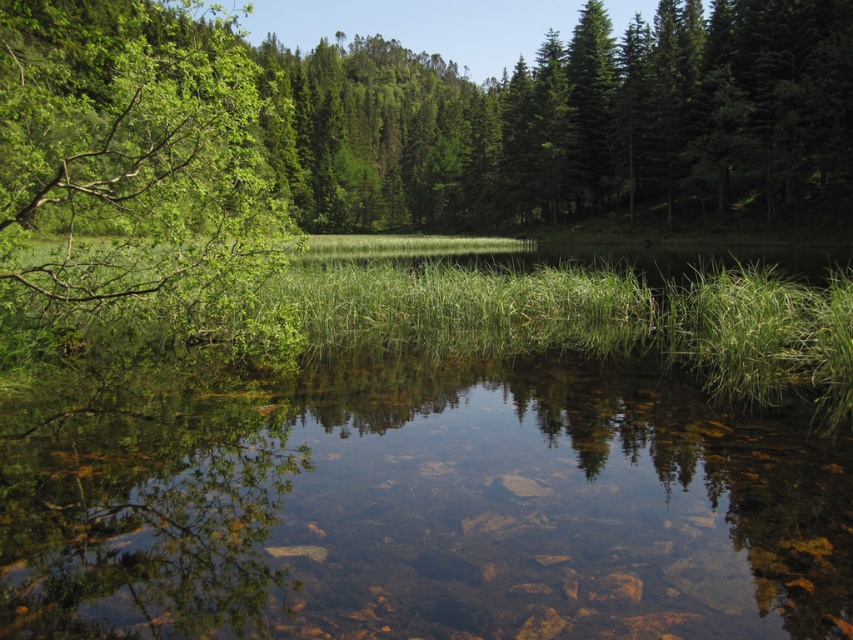
You are standing at the edge of the water and want to walk towards the green grass at center. Will you pass by the green leafy tree at left on your way?

Yes, you will pass by the green leafy tree at left on your way to the green grass at center because the green leafy tree at left is closer to you than the green grass at center.

You are standing at the edge of the water and want to walk towards the dense forest in the background. Which object will you step on first, the clear water at center or the green grass at center?

You will step on the clear water at center first because it is in front of the green grass at center, meaning the water is closer to your current position.

You are standing at the edge of the water in the serene landscape. You notice two points marked in the scene. Which point, point (202, 468) or point (252, 228), is closer to you?

Point (202, 468) is closer to the viewer than point (252, 228).